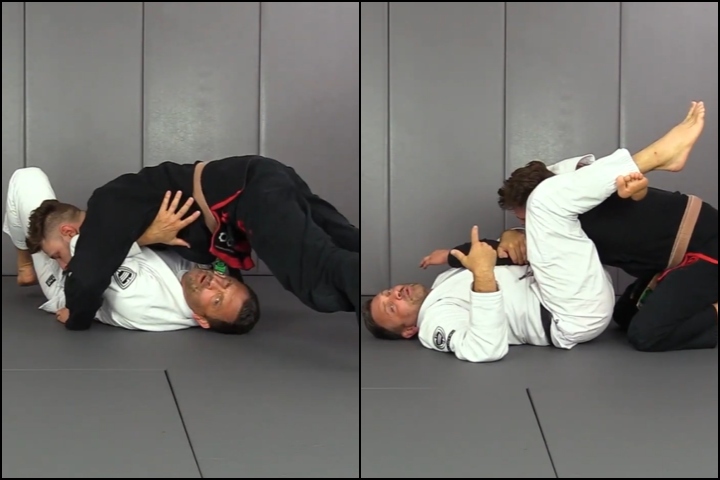
I want to click on wall, so click(x=225, y=96), click(x=425, y=88).